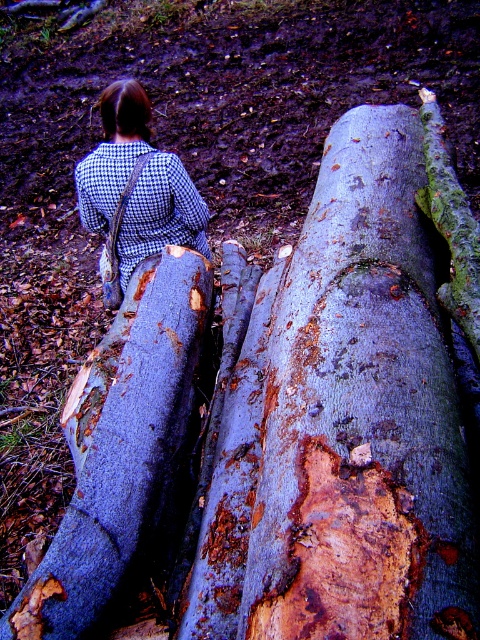
Is rusty bark log at center bigger than checkered fabric coat at center?

Correct, rusty bark log at center is larger in size than checkered fabric coat at center.

In the scene shown: Does rusty bark log at center appear under checkered fabric coat at center?

Yes.

This screenshot has height=640, width=480. I want to click on rusty bark log at center, so click(x=344, y=424).

Identify the location of rusty bark log at center. (344, 424).

Looking at this image, is rusty wood log at center positioned behind checkered fabric coat at center?

No, it is not.

Is rusty wood log at center above checkered fabric coat at center?

No.

The image size is (480, 640). What do you see at coordinates (120, 445) in the screenshot?
I see `rusty wood log at center` at bounding box center [120, 445].

Locate an element on the screen. The height and width of the screenshot is (640, 480). rusty wood log at center is located at coordinates (120, 445).

Measure the distance from rusty bark log at center to rusty wood log at center.

They are 44.74 centimeters apart.

Is rusty bark log at center closer to the viewer compared to rusty wood log at center?

Yes, it is.

Between point (376, 582) and point (156, 260), which one is positioned behind?

The point (156, 260) is more distant.

Find the location of `rusty bark log at center`. rusty bark log at center is located at coordinates (344, 424).